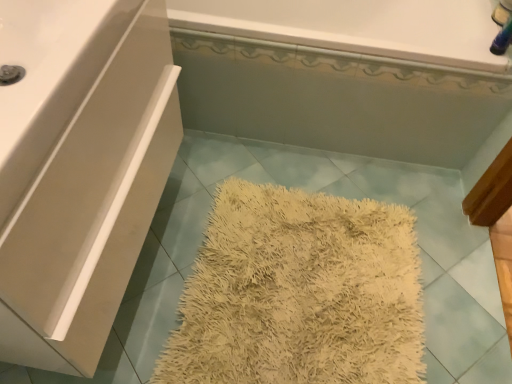
Question: Can you confirm if white glossy bathtub at upper center, the 1th bath in the front-to-back sequence, is smaller than white matte cabinet at upper left?

Choices:
 (A) yes
 (B) no

Answer: (B)

Question: Is white glossy bathtub at upper center, which is counted as the second bath, starting from the back, not inside white matte cabinet at upper left?

Choices:
 (A) no
 (B) yes

Answer: (B)

Question: Is white glossy bathtub at upper center, which is counted as the second bath, starting from the back, positioned with its back to white matte cabinet at upper left?

Choices:
 (A) no
 (B) yes

Answer: (A)

Question: From a real-world perspective, is white glossy bathtub at upper center, the 1th bath in the front-to-back sequence, physically below white matte cabinet at upper left?

Choices:
 (A) yes
 (B) no

Answer: (A)

Question: Is white glossy bathtub at upper center, the 1th bath in the front-to-back sequence, facing towards white matte cabinet at upper left?

Choices:
 (A) no
 (B) yes

Answer: (B)

Question: Do you think white matte cabinet at upper left is within white glossy bathtub at upper center, the 2th bath positioned from the front, or outside of it?

Choices:
 (A) inside
 (B) outside

Answer: (B)

Question: Considering their positions, is white matte cabinet at upper left located in front of or behind white glossy bathtub at upper center, marked as the 1th bath in a back-to-front arrangement?

Choices:
 (A) behind
 (B) front

Answer: (B)

Question: Is white matte cabinet at upper left wider or thinner than white glossy bathtub at upper center, the 2th bath positioned from the front?

Choices:
 (A) thin
 (B) wide

Answer: (B)

Question: Looking at the image, does white matte cabinet at upper left seem bigger or smaller compared to white glossy bathtub at upper center, the 2th bath positioned from the front?

Choices:
 (A) small
 (B) big

Answer: (B)

Question: From a real-world perspective, is white glossy bathtub at upper center, which is counted as the second bath, starting from the back, physically located above or below white glossy bathtub at upper center, the 2th bath positioned from the front?

Choices:
 (A) below
 (B) above

Answer: (A)

Question: Considering the positions of white glossy bathtub at upper center, the 1th bath in the front-to-back sequence, and white glossy bathtub at upper center, marked as the 1th bath in a back-to-front arrangement, in the image, is white glossy bathtub at upper center, the 1th bath in the front-to-back sequence, taller or shorter than white glossy bathtub at upper center, marked as the 1th bath in a back-to-front arrangement,?

Choices:
 (A) tall
 (B) short

Answer: (A)

Question: Is white glossy bathtub at upper center, which is counted as the second bath, starting from the back, wider or thinner than white glossy bathtub at upper center, marked as the 1th bath in a back-to-front arrangement?

Choices:
 (A) wide
 (B) thin

Answer: (A)

Question: Relative to white glossy bathtub at upper center, marked as the 1th bath in a back-to-front arrangement, is white glossy bathtub at upper center, which is counted as the second bath, starting from the back, in front or behind?

Choices:
 (A) behind
 (B) front

Answer: (B)

Question: Is point pyautogui.click(x=248, y=102) closer or farther from the camera than point pyautogui.click(x=31, y=87)?

Choices:
 (A) farther
 (B) closer

Answer: (A)

Question: From the image's perspective, is white glossy bathtub at upper center, which is counted as the second bath, starting from the back, located above or below white matte cabinet at upper left?

Choices:
 (A) below
 (B) above

Answer: (B)